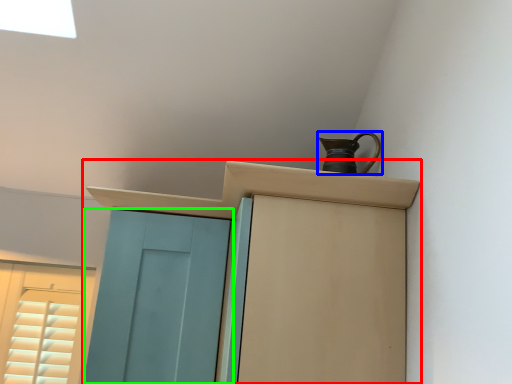
Question: Which object is positioned farthest from cupboard (highlighted by a red box)? Select from jug (highlighted by a blue box) and door (highlighted by a green box).

Choices:
 (A) jug
 (B) door

Answer: (B)